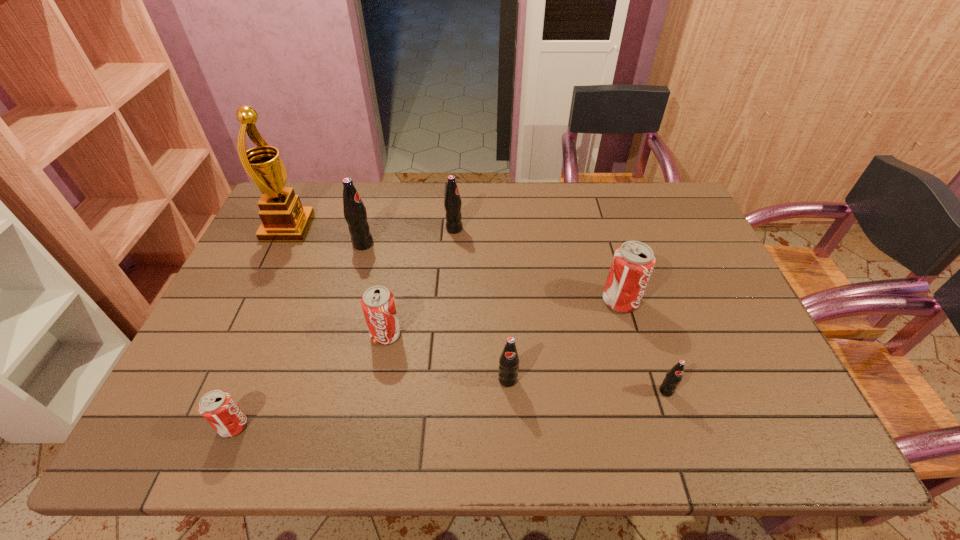
At what (x,y) coordinates should I click in order to perform the action: click on vacant space situated 0.120m on the front label of the second smallest black pop. Please return your answer as a coordinate pair (x, y). The height and width of the screenshot is (540, 960). Looking at the image, I should click on (511, 438).

Identify the location of vacant region located 0.060m on the front label of the smallest black pop. Image resolution: width=960 pixels, height=540 pixels. (677, 422).

The height and width of the screenshot is (540, 960). Find the location of `vacant space located on the back of the nearest soda can`. vacant space located on the back of the nearest soda can is located at coordinates (291, 285).

At what (x,y) coordinates should I click in order to perform the action: click on award that is at the far edge. Please return your answer as a coordinate pair (x, y). Looking at the image, I should click on (284, 219).

Where is `pop situated at the far edge`? pop situated at the far edge is located at coordinates (452, 202).

The height and width of the screenshot is (540, 960). I want to click on object situated at the near edge, so click(x=219, y=409).

The width and height of the screenshot is (960, 540). Find the location of `award at the left edge`. award at the left edge is located at coordinates (284, 219).

Identify the location of soda can that is at the left edge. (219, 409).

Image resolution: width=960 pixels, height=540 pixels. What are the coordinates of `object that is positioned at the far left corner` in the screenshot? It's located at (284, 219).

Find the location of a particular element. object that is at the near left corner is located at coordinates (219, 409).